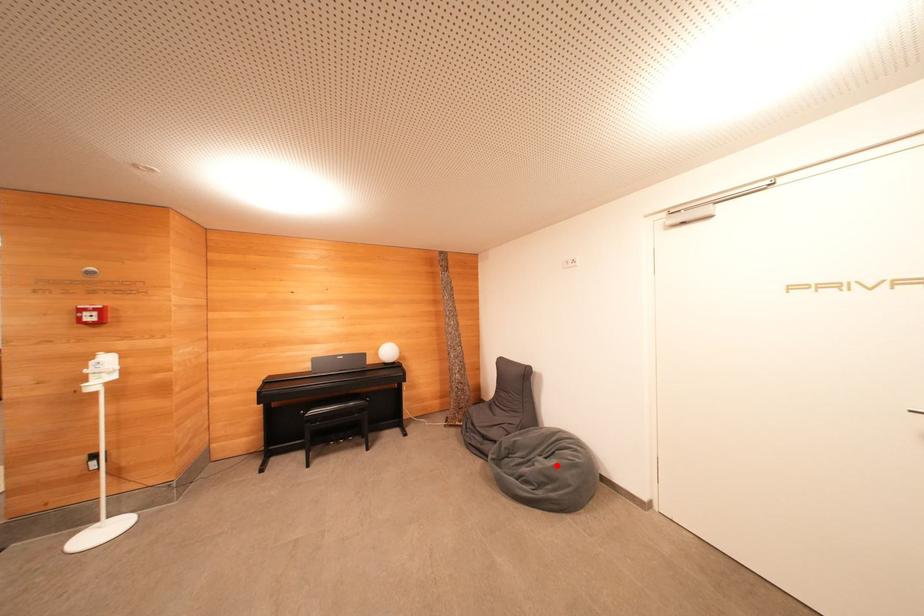
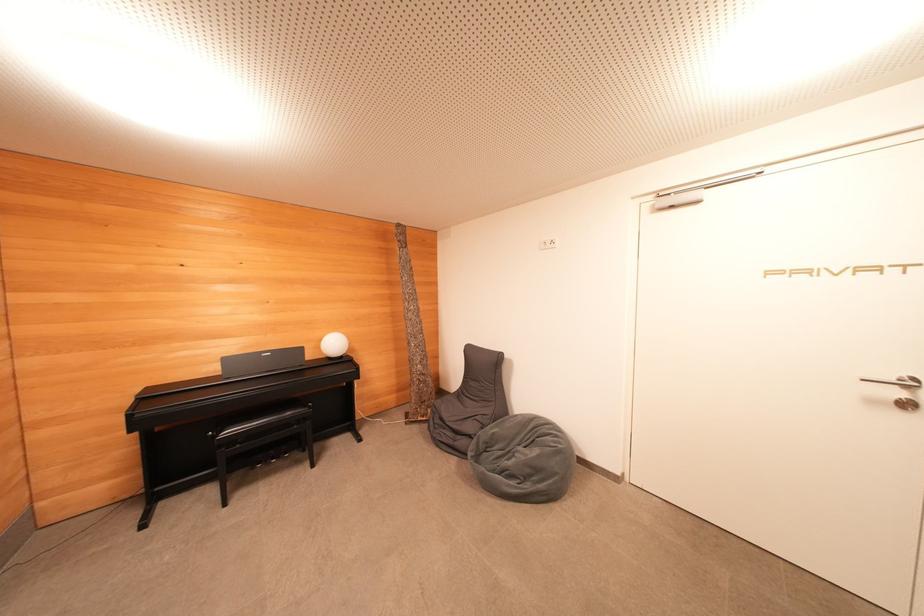
Question: I am providing you with two images of the same scene from different viewpoints. A red point is marked on the first image. At the location where the point appears in image 1, is it still visible in image 2?

Choices:
 (A) Yes
 (B) No

Answer: (A)